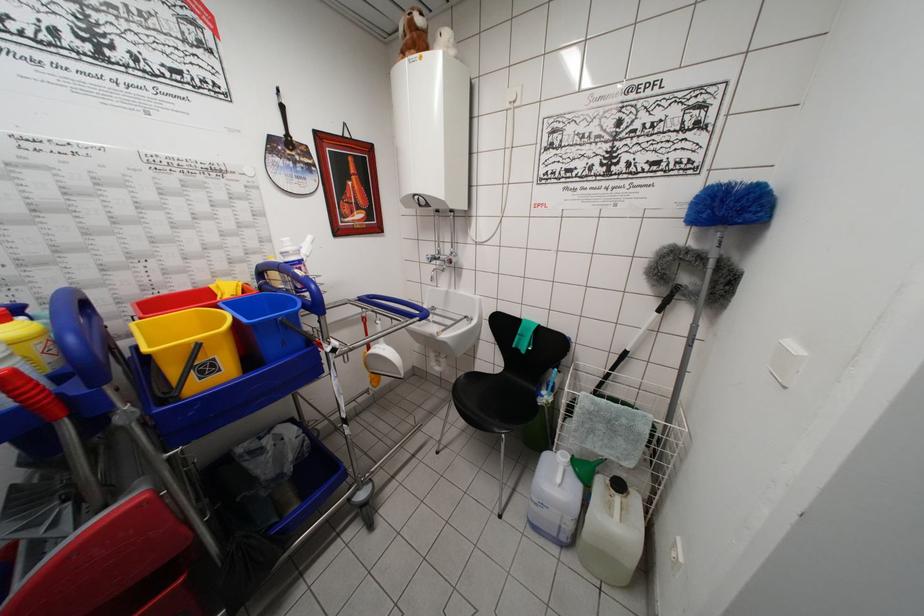
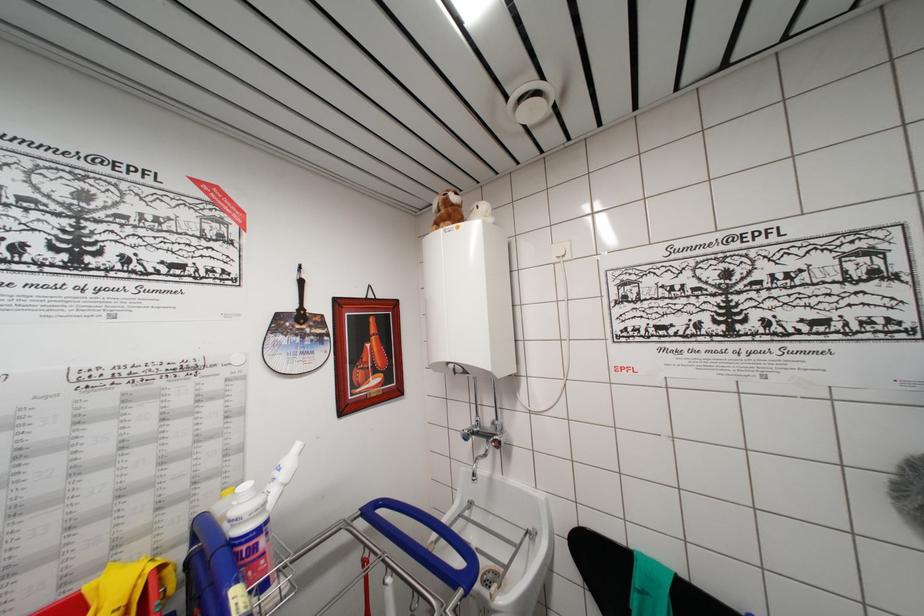
Question: The images are taken continuously from a first-person perspective. In which direction is your viewpoint rotating?

Choices:
 (A) Left
 (B) Right
 (C) Up
 (D) Down

Answer: (C)